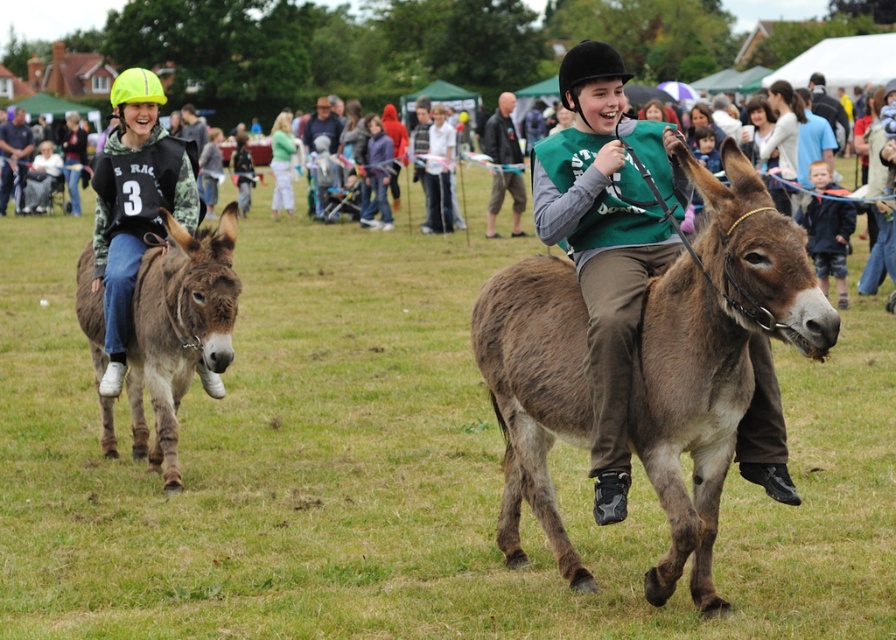
Question: Among these objects, which one is farthest from the camera?

Choices:
 (A) neon yellow helmet at left
 (B) brown fuzzy mule at center

Answer: (A)

Question: Which point appears closest to the camera in this image?

Choices:
 (A) (208, 276)
 (B) (184, 204)
 (C) (655, 333)

Answer: (C)

Question: Is brown fuzzy mule at center to the left of neon yellow helmet at left from the viewer's perspective?

Choices:
 (A) no
 (B) yes

Answer: (A)

Question: Does brown fuzzy mule at center appear on the right side of neon yellow helmet at left?

Choices:
 (A) no
 (B) yes

Answer: (B)

Question: Is brown fuzzy mule at center positioned behind brown fuzzy mule at left?

Choices:
 (A) no
 (B) yes

Answer: (A)

Question: Which object appears farthest from the camera in this image?

Choices:
 (A) brown fuzzy mule at left
 (B) neon yellow helmet at left

Answer: (B)